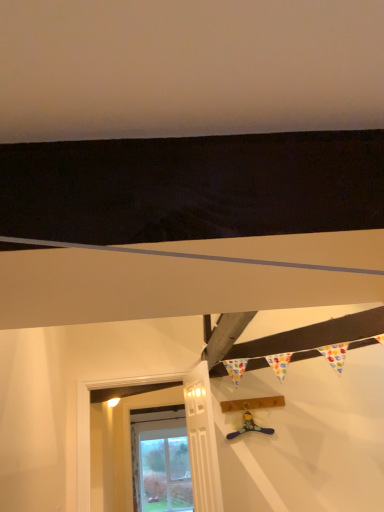
The height and width of the screenshot is (512, 384). What are the coordinates of `white painted wood at lower left` in the screenshot? It's located at (110, 448).

Does blue fabric toy at center have a smaller size compared to white painted wood door at lower left?

Yes, blue fabric toy at center is smaller than white painted wood door at lower left.

Is blue fabric toy at center facing towards white painted wood door at lower left?

No.

Consider the image. Are blue fabric toy at center and white painted wood door at lower left located far from each other?

No, blue fabric toy at center is not far away from white painted wood door at lower left.

How many degrees apart are the facing directions of blue fabric toy at center and white painted wood door at lower left?

blue fabric toy at center and white painted wood door at lower left are facing 81 degrees away from each other.

Considering the relative sizes of white painted wood door at lower left and blue fabric toy at center in the image provided, is white painted wood door at lower left wider than blue fabric toy at center?

Yes, white painted wood door at lower left is wider than blue fabric toy at center.

Between white painted wood door at lower left and blue fabric toy at center, which one is positioned in front?

white painted wood door at lower left.

Are white painted wood door at lower left and blue fabric toy at center making contact?

No, white painted wood door at lower left is not beside blue fabric toy at center.

Considering the relative sizes of white painted wood door at lower left and white painted wood at lower left in the image provided, is white painted wood door at lower left shorter than white painted wood at lower left?

Correct, white painted wood door at lower left is not as tall as white painted wood at lower left.

Which object is closer to the camera taking this photo, white painted wood door at lower left or white painted wood at lower left?

Positioned in front is white painted wood door at lower left.

Which of these two, white painted wood door at lower left or white painted wood at lower left, is thinner?

white painted wood door at lower left is thinner.

Would you say white painted wood door at lower left is to the left or to the right of white painted wood at lower left in the picture?

In the image, white painted wood door at lower left appears on the right side of white painted wood at lower left.

Where is `toy located on the right of white painted wood at lower left`? This screenshot has width=384, height=512. toy located on the right of white painted wood at lower left is located at coordinates (249, 426).

Which is behind, point (217, 479) or point (251, 421)?

The point (251, 421) is farther from the camera.

From the image's perspective, is white painted wood at lower left above or below blue fabric toy at center?

From the image's perspective, white painted wood at lower left appears below blue fabric toy at center.

From a real-world perspective, who is located higher, white painted wood at lower left or blue fabric toy at center?

blue fabric toy at center.

How many degrees apart are the facing directions of white painted wood at lower left and white painted wood door at lower left?

The angle between the facing direction of white painted wood at lower left and the facing direction of white painted wood door at lower left is 82.8 degrees.

Between white painted wood at lower left and white painted wood door at lower left, which one has smaller width?

With smaller width is white painted wood door at lower left.

Where is `window frame positioned vertically above the white painted wood door at lower left (from a real-world perspective)`? The height and width of the screenshot is (512, 384). window frame positioned vertically above the white painted wood door at lower left (from a real-world perspective) is located at coordinates (110, 448).

Considering the relative positions of white painted wood at lower left and white painted wood door at lower left in the image provided, is white painted wood at lower left to the left of white painted wood door at lower left from the viewer's perspective?

Indeed, white painted wood at lower left is positioned on the left side of white painted wood door at lower left.

Who is smaller, blue fabric toy at center or white painted wood at lower left?

blue fabric toy at center is smaller.

From a real-world perspective, which object rests below the other?

From a 3D spatial view, white painted wood at lower left is below.

Would you say blue fabric toy at center is outside white painted wood at lower left?

blue fabric toy at center is positioned outside white painted wood at lower left.

Is blue fabric toy at center not close to white painted wood at lower left?

Indeed, blue fabric toy at center is not near white painted wood at lower left.

Locate an element on the screen. toy located below the white painted wood door at lower left (from the image's perspective) is located at coordinates (249, 426).

I want to click on toy behind the white painted wood door at lower left, so [x=249, y=426].

Considering their positions, is white painted wood door at lower left positioned further to blue fabric toy at center than white painted wood at lower left?

Among the two, white painted wood at lower left is located further to blue fabric toy at center.

Consider the image. From the image, which object appears to be nearer to white painted wood at lower left, blue fabric toy at center or white painted wood door at lower left?

blue fabric toy at center is closer to white painted wood at lower left.

Which object lies nearer to the anchor point white painted wood at lower left, white painted wood door at lower left or blue fabric toy at center?

The object closer to white painted wood at lower left is blue fabric toy at center.

Based on their spatial positions, is white painted wood at lower left or blue fabric toy at center further from white painted wood door at lower left?

white painted wood at lower left is further to white painted wood door at lower left.

Estimate the real-world distances between objects in this image. Which object is further from white painted wood door at lower left, blue fabric toy at center or white painted wood at lower left?

The object further to white painted wood door at lower left is white painted wood at lower left.

From the image, which object appears to be farther from blue fabric toy at center, white painted wood at lower left or white painted wood door at lower left?

white painted wood at lower left.

The height and width of the screenshot is (512, 384). I want to click on window frame between white painted wood door at lower left and blue fabric toy at center in the front-back direction, so click(110, 448).